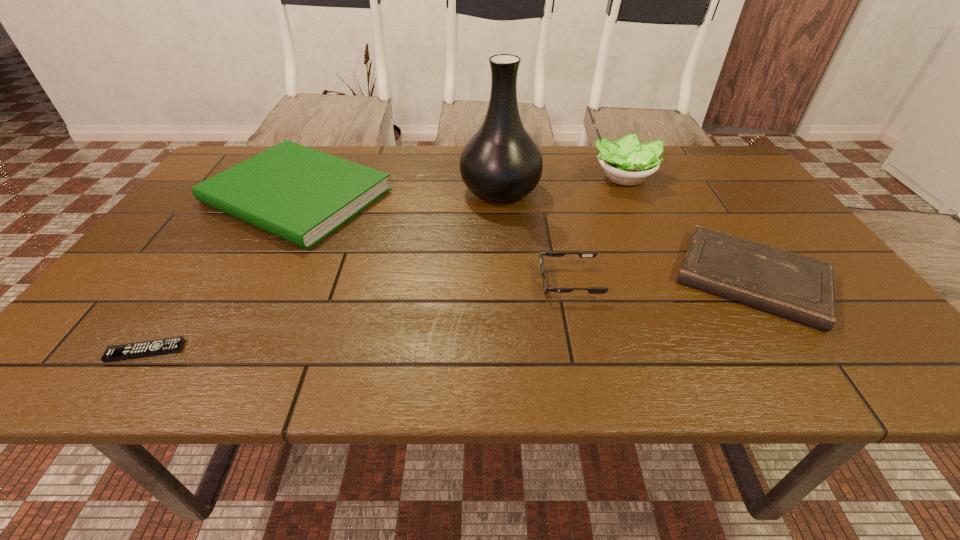
Identify the location of vacant point located between the shorter paperback book and the tallest object. (626, 234).

Select which object is the fourth closest to the left paperback book. Please provide its 2D coordinates. Your answer should be formatted as a tuple, i.e. [(x, y)], where the tuple contains the x and y coordinates of a point satisfying the conditions above.

[(627, 162)]

Identify the location of the fourth closest object to the left paperback book. (627, 162).

The image size is (960, 540). In order to click on vacant area in the image that satisfies the following two spatial constraints: 1. on the back side of the third tallest object; 2. on the right side of the fifth shortest object in this screenshot , I will do `click(307, 177)`.